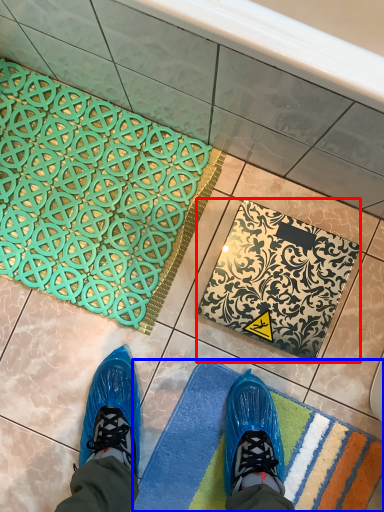
Question: Among these objects, which one is nearest to the camera, bath mat (highlighted by a red box) or bath mat (highlighted by a blue box)?

Choices:
 (A) bath mat
 (B) bath mat

Answer: (B)